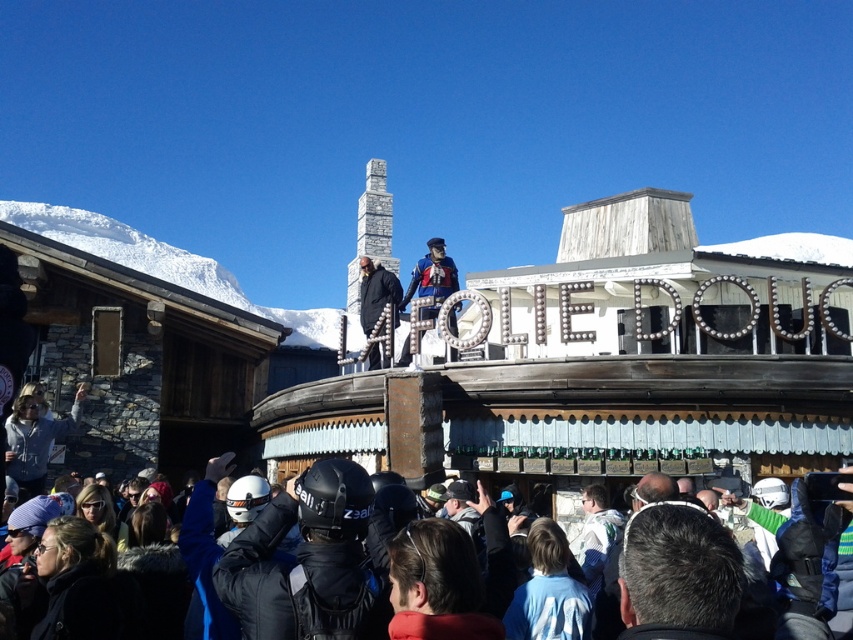
Question: Can you confirm if blue fabric skier at center is positioned to the right of black matte coat at center?

Choices:
 (A) yes
 (B) no

Answer: (A)

Question: Observing the image, what is the correct spatial positioning of black matte helmet at center in reference to blue fabric skier at center?

Choices:
 (A) below
 (B) above

Answer: (A)

Question: Considering the relative positions of dark brown hair at center and black matte coat at center in the image provided, where is dark brown hair at center located with respect to black matte coat at center?

Choices:
 (A) right
 (B) left

Answer: (A)

Question: Which point is closer to the camera taking this photo?

Choices:
 (A) (409, 362)
 (B) (294, 513)
 (C) (697, 614)
 (D) (376, 307)

Answer: (C)

Question: Among these points, which one is farthest from the camera?

Choices:
 (A) (363, 582)
 (B) (274, 529)
 (C) (440, 301)

Answer: (C)

Question: Estimate the real-world distances between objects in this image. Which object is farther from the blue fabric skier at center?

Choices:
 (A) black matte coat at center
 (B) dark blue jacket at lower center
 (C) black matte helmet at center
 (D) dark brown hair at center

Answer: (D)